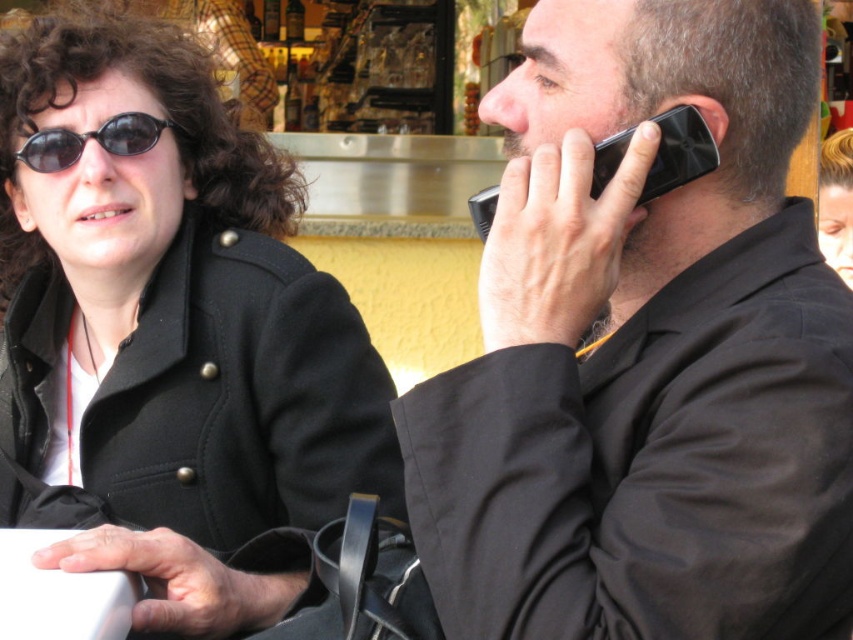
You are a photographer trying to capture a clear shot of both the black plastic phone at right and the black plastic sunglasses at upper left. Based on their positions, which object should you focus on first to ensure both are in frame?

The black plastic phone at right is positioned under the black plastic sunglasses at upper left, so focusing on the sunglasses first will ensure the phone remains in the frame below it.